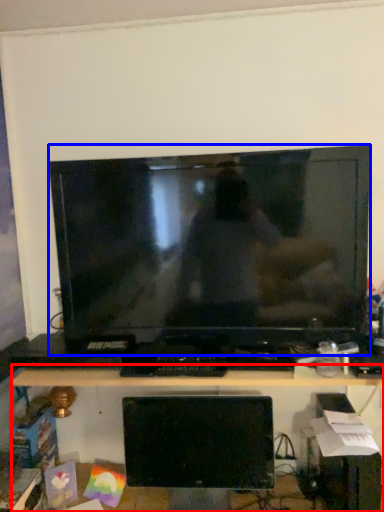
Question: Which object appears closest to the camera in this image, desk (highlighted by a red box) or television (highlighted by a blue box)?

Choices:
 (A) desk
 (B) television

Answer: (A)